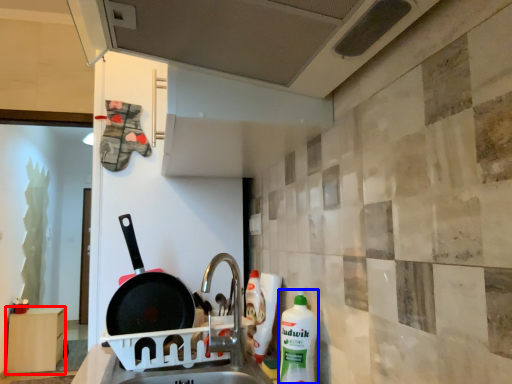
Question: Among these objects, which one is farthest to the camera, furniture (highlighted by a red box) or cleaning product (highlighted by a blue box)?

Choices:
 (A) furniture
 (B) cleaning product

Answer: (A)